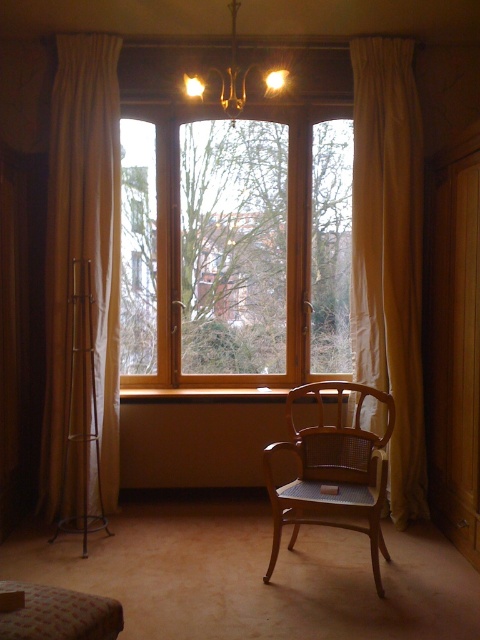
You are planning to install a new light fixture in the living room. You see the beige fabric curtain at left and the matte gold chandelier at upper center. Which object is positioned more to the left side of the room?

The beige fabric curtain at left is positioned more to the left side of the room than the matte gold chandelier at upper center.

You are standing in the living room and want to place a small plant between the two points, point (75, 493) and point (228, 115). Which point is closer to you where you should start placing the plant?

Point (75, 493) is closer to the viewer than point (228, 115), so you should start placing the plant near point (75, 493).